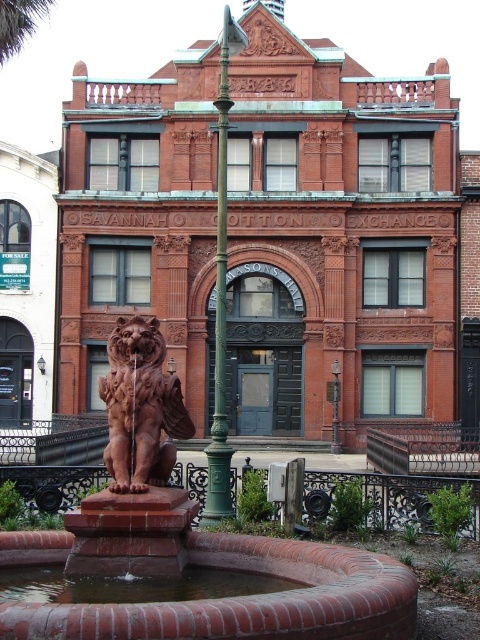
Can you confirm if matte brown lion at center is smaller than green metal pole at center?

No.

Between matte brown lion at center and green metal pole at center, which one has less height?

green metal pole at center is shorter.

Which is behind, point (177, 428) or point (334, 424)?

The point (334, 424) is behind.

At what (x,y) coordinates should I click in order to perform the action: click on matte brown lion at center. Please return your answer as a coordinate pair (x, y). Looking at the image, I should click on (141, 406).

Is green cast iron pole at center positioned behind green leafy palm tree at upper left?

No.

Is point (213, 508) positioned behind point (4, 20)?

That is False.

Who is more distant from viewer, (215, 516) or (22, 19)?

Positioned behind is point (22, 19).

Find the location of a particular element. green cast iron pole at center is located at coordinates (220, 296).

Can you confirm if matte terracotta lion at center is bigger than matte brown lion at center?

No, matte terracotta lion at center is not bigger than matte brown lion at center.

From the picture: Is matte terracotta lion at center closer to the viewer compared to matte brown lion at center?

Yes, it is in front of matte brown lion at center.

Which is behind, point (211, 611) or point (146, 392)?

Positioned behind is point (146, 392).

The width and height of the screenshot is (480, 640). I want to click on matte terracotta lion at center, so click(186, 548).